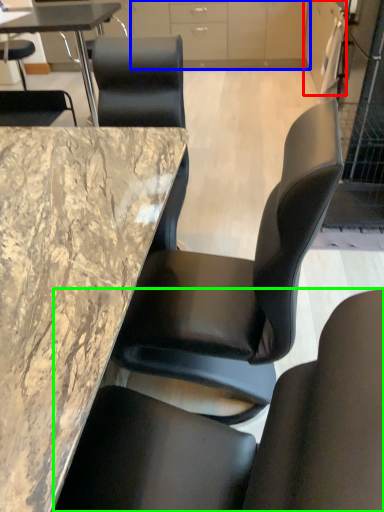
Question: Which object is positioned farthest from cabinetry (highlighted by a red box)? Select from cabinetry (highlighted by a blue box) and chair (highlighted by a green box).

Choices:
 (A) cabinetry
 (B) chair

Answer: (B)